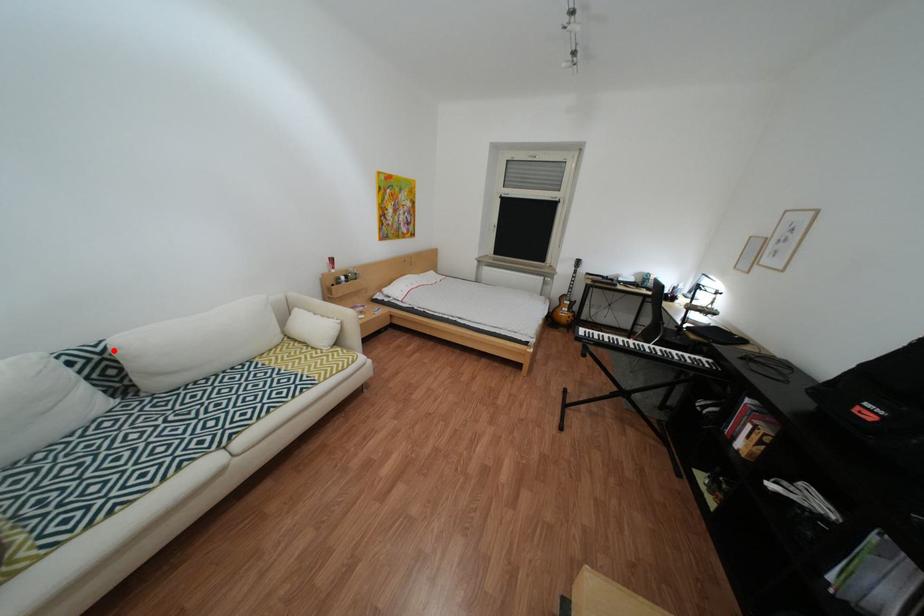
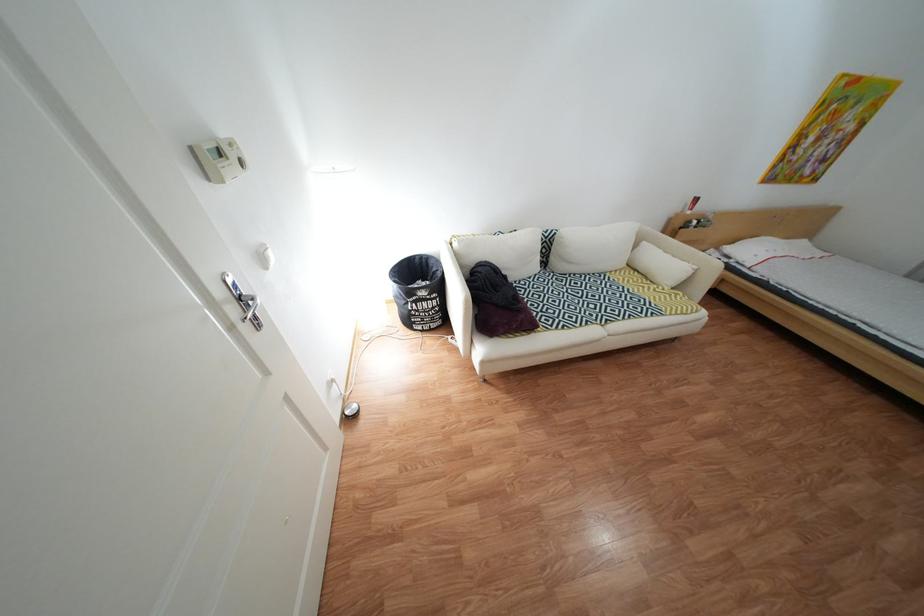
Locate, in the second image, the point that corresponds to the highlighted location in the first image.

(562, 236)